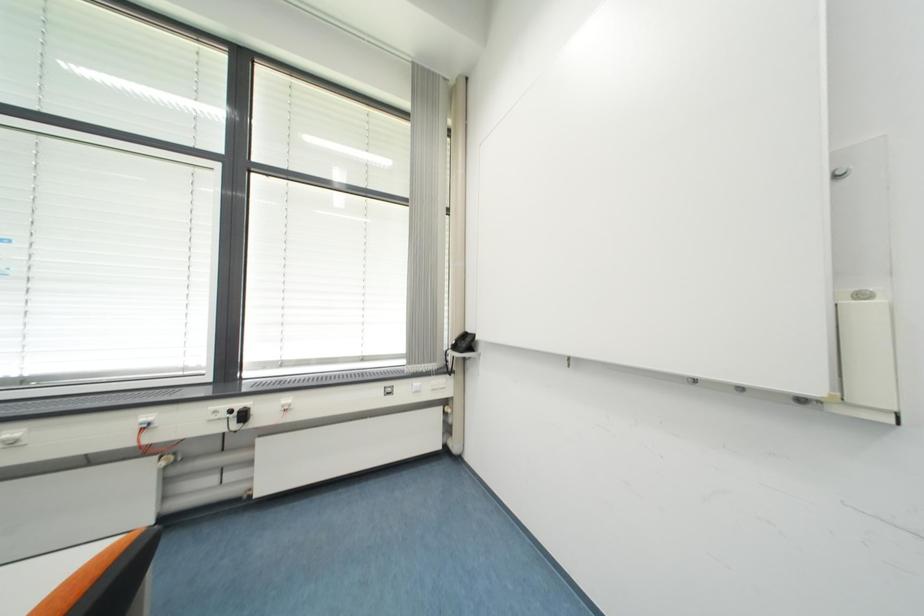
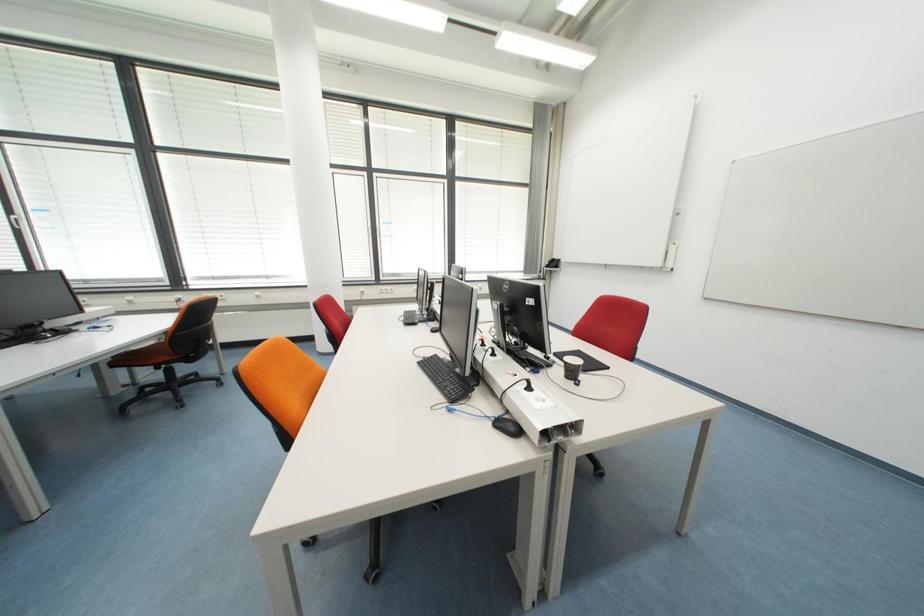
Question: What movement of the cameraman would produce the second image?

Choices:
 (A) Left
 (B) Right
 (C) Forward
 (D) Backward

Answer: (D)